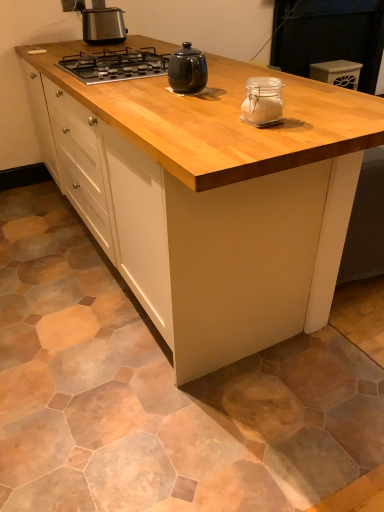
Locate an element on the screen. free spot in front of glossy ceramic mug at upper center, placed as the second kitchen appliance when sorted from back to front is located at coordinates (194, 102).